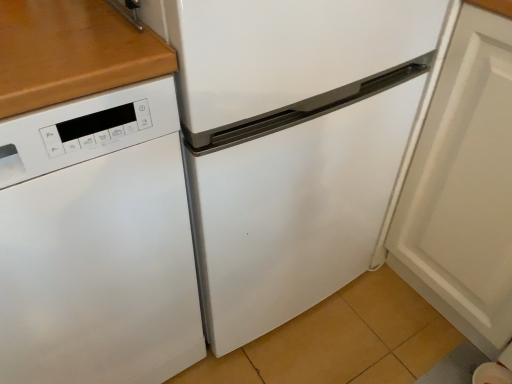
Question: From the image's perspective, relative to white matte dishwasher at left, is white matte cabinet door at lower right above or below?

Choices:
 (A) below
 (B) above

Answer: (B)

Question: In terms of width, does white matte cabinet door at lower right look wider or thinner when compared to white matte dishwasher at left?

Choices:
 (A) wide
 (B) thin

Answer: (B)

Question: Relative to white matte dishwasher at left, is white matte cabinet door at lower right in front or behind?

Choices:
 (A) behind
 (B) front

Answer: (A)

Question: In terms of size, does white matte dishwasher at left appear bigger or smaller than white matte cabinet door at lower right?

Choices:
 (A) big
 (B) small

Answer: (A)

Question: Considering the positions of white matte dishwasher at left and white matte cabinet door at lower right in the image, is white matte dishwasher at left wider or thinner than white matte cabinet door at lower right?

Choices:
 (A) wide
 (B) thin

Answer: (A)

Question: Is white matte dishwasher at left inside the boundaries of white matte cabinet door at lower right, or outside?

Choices:
 (A) inside
 (B) outside

Answer: (B)

Question: Visually, is white matte dishwasher at left positioned to the left or to the right of white matte cabinet door at lower right?

Choices:
 (A) right
 (B) left

Answer: (B)